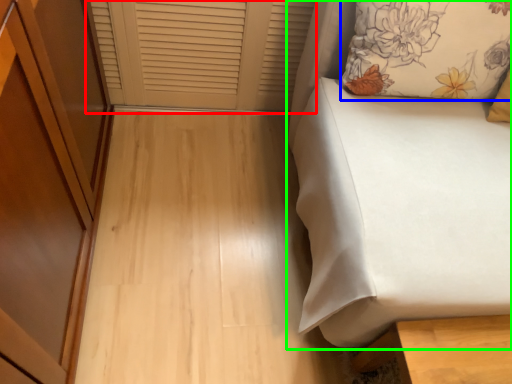
Question: Which is nearer to the window frame (highlighted by a red box)? pillow (highlighted by a blue box) or furniture (highlighted by a green box).

Choices:
 (A) pillow
 (B) furniture

Answer: (A)